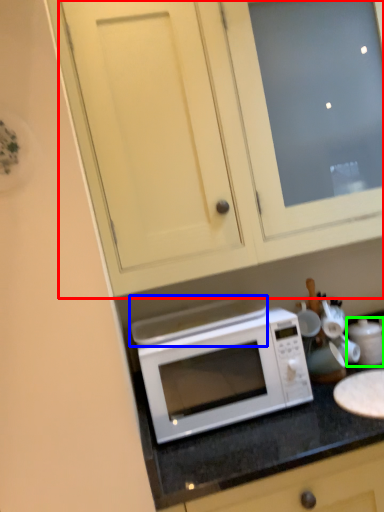
Question: Based on their relative distances, which object is nearer to cabinetry (highlighted by a red box)? Choose from exhaust hood (highlighted by a blue box) and appliance (highlighted by a green box).

Choices:
 (A) exhaust hood
 (B) appliance

Answer: (A)